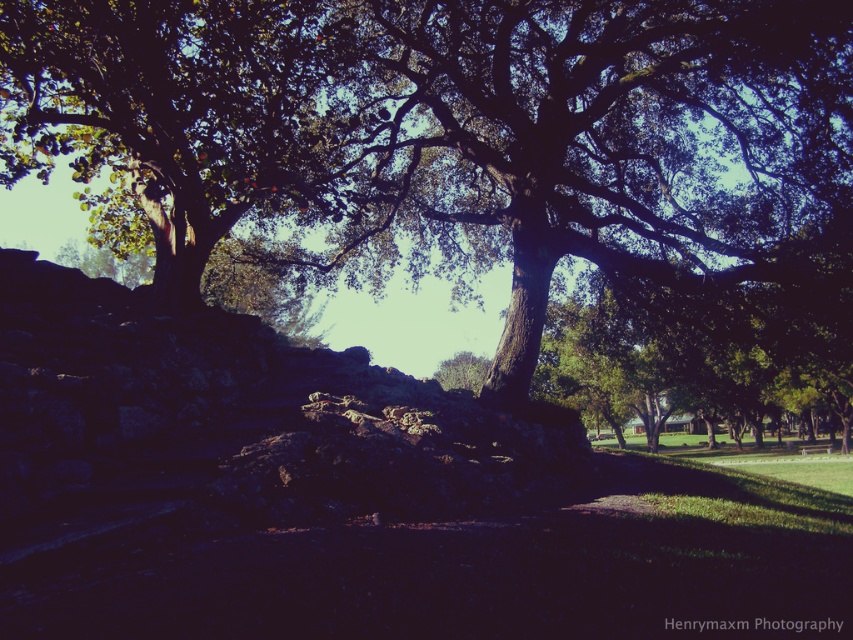
Consider the image. Does green leafy tree at center have a larger size compared to green leafy tree at upper left?

Yes.

Is point (741, 99) positioned before point (231, 72)?

No, it is not.

The image size is (853, 640). I want to click on green leafy tree at center, so click(x=601, y=141).